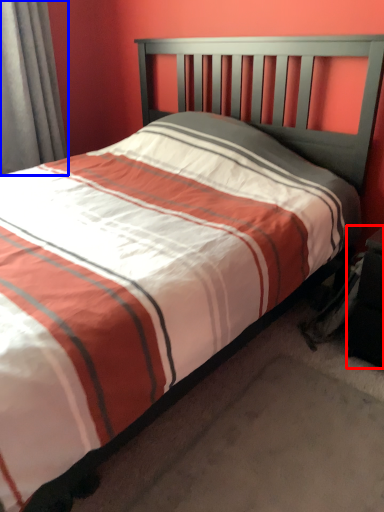
Question: Which of the following is the farthest to the observer, nightstand (highlighted by a red box) or curtain (highlighted by a blue box)?

Choices:
 (A) nightstand
 (B) curtain

Answer: (B)